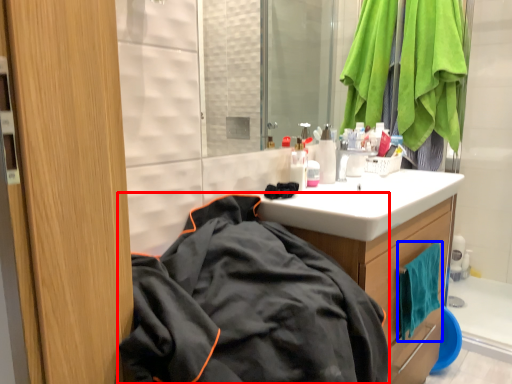
Question: Which object is further to the camera taking this photo, jacket (highlighted by a red box) or beach towel (highlighted by a blue box)?

Choices:
 (A) jacket
 (B) beach towel

Answer: (B)